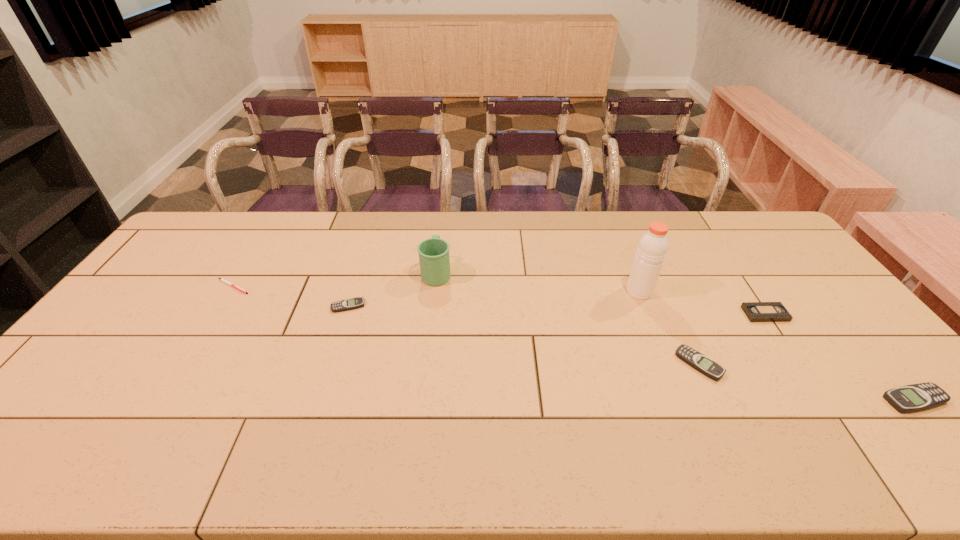
I want to click on free space that is in between the rightmost beeper and the second beeper from right to left, so click(x=806, y=382).

In order to click on unoccupied area between the sixth tallest object and the leftmost object in this screenshot , I will do `click(291, 296)`.

Find the location of a particular element. free space between the second nearest object and the tallest beeper is located at coordinates (806, 382).

Locate an element on the screen. Image resolution: width=960 pixels, height=540 pixels. free space between the second tallest object and the second tallest beeper is located at coordinates (567, 318).

Image resolution: width=960 pixels, height=540 pixels. I want to click on vacant point located between the second object from right to left and the tallest object, so (702, 302).

This screenshot has height=540, width=960. In order to click on vacant area between the second object from right to left and the shaker in this screenshot , I will do `click(702, 302)`.

You are a GUI agent. You are given a task and a screenshot of the screen. Output one action in this format:
    pyautogui.click(x=<x>, y=<y>)
    Task: Click on the free space between the second nearest beeper and the leftmost object
    
    Given the screenshot: What is the action you would take?
    pyautogui.click(x=466, y=325)

At what (x,y) coordinates should I click in order to perform the action: click on vacant space in between the shaker and the shortest object. Please return your answer as a coordinate pair (x, y). Image resolution: width=960 pixels, height=540 pixels. Looking at the image, I should click on (436, 289).

You are a GUI agent. You are given a task and a screenshot of the screen. Output one action in this format:
    pyautogui.click(x=<x>, y=<y>)
    Task: Click on the empty space between the second beeper from right to left and the sixth shortest object
    Image resolution: width=960 pixels, height=540 pixels.
    Given the screenshot: What is the action you would take?
    pyautogui.click(x=567, y=318)

Select which object appears as the sixth closest to the mug. Please provide its 2D coordinates. Your answer should be formatted as a tuple, i.e. [(x, y)], where the tuple contains the x and y coordinates of a point satisfying the conditions above.

[(916, 397)]